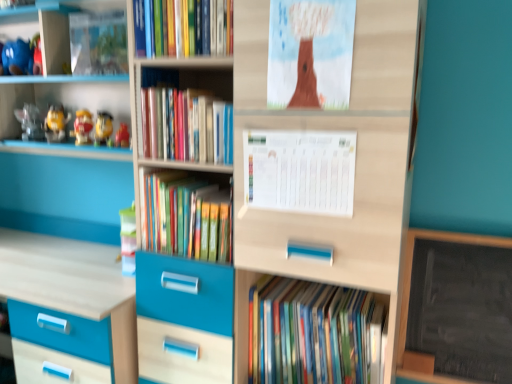
Question: From the image's perspective, is matte yellow toy at left, positioned as the fourth toy in left-to-right order, located above brown paper at upper center, positioned as the 2th paperback book in bottom-to-top order?

Choices:
 (A) no
 (B) yes

Answer: (A)

Question: Is matte yellow toy at left, positioned as the fourth toy in left-to-right order, completely or partially outside of brown paper at upper center, positioned as the 2th paperback book in bottom-to-top order?

Choices:
 (A) yes
 (B) no

Answer: (A)

Question: Considering the relative positions of matte yellow toy at left, positioned as the fourth toy in left-to-right order, and brown paper at upper center, positioned as the 2th paperback book in bottom-to-top order, in the image provided, is matte yellow toy at left, positioned as the fourth toy in left-to-right order, behind brown paper at upper center, positioned as the 2th paperback book in bottom-to-top order,?

Choices:
 (A) yes
 (B) no

Answer: (A)

Question: Can you confirm if matte yellow toy at left, positioned as the fourth toy in left-to-right order, is smaller than brown paper at upper center, arranged as the 1th paperback book when viewed from the top?

Choices:
 (A) yes
 (B) no

Answer: (B)

Question: Is brown paper at upper center, positioned as the 2th paperback book in bottom-to-top order, at the back of matte yellow toy at left, positioned as the fourth toy in left-to-right order?

Choices:
 (A) yes
 (B) no

Answer: (B)

Question: From the image's perspective, is hardcover books at center, which appears as the 3th book when ordered from the bottom, positioned above or below matte yellow toy at upper left, which is the second toy in right-to-left order?

Choices:
 (A) below
 (B) above

Answer: (A)

Question: From a real-world perspective, relative to matte yellow toy at upper left, which is the second toy in right-to-left order, is hardcover books at center, the second book when ordered from top to bottom, vertically above or below?

Choices:
 (A) below
 (B) above

Answer: (B)

Question: In terms of size, does hardcover books at center, the second book when ordered from top to bottom, appear bigger or smaller than matte yellow toy at upper left, which is the second toy in right-to-left order?

Choices:
 (A) big
 (B) small

Answer: (A)

Question: Is hardcover books at center, which appears as the 3th book when ordered from the bottom, wider or thinner than matte yellow toy at upper left, which is the second toy in right-to-left order?

Choices:
 (A) thin
 (B) wide

Answer: (B)

Question: Considering the positions of matte yellow toy at left, positioned as the fourth toy in left-to-right order, and hardcover books at center, which appears as the 3th book when ordered from the bottom, in the image, is matte yellow toy at left, positioned as the fourth toy in left-to-right order, bigger or smaller than hardcover books at center, which appears as the 3th book when ordered from the bottom,?

Choices:
 (A) big
 (B) small

Answer: (B)

Question: Is matte yellow toy at left, positioned as the fourth toy in left-to-right order, spatially inside hardcover books at center, which appears as the 3th book when ordered from the bottom, or outside of it?

Choices:
 (A) inside
 (B) outside

Answer: (B)

Question: From the image's perspective, is matte yellow toy at left, positioned as the fourth toy in left-to-right order, above or below hardcover books at center, the second book when ordered from top to bottom?

Choices:
 (A) above
 (B) below

Answer: (A)

Question: Does point pyautogui.click(x=106, y=119) appear closer or farther from the camera than point pyautogui.click(x=225, y=157)?

Choices:
 (A) farther
 (B) closer

Answer: (A)

Question: From a real-world perspective, is hardcover books at center, marked as the 2th book in a bottom-to-top arrangement, positioned above or below matte yellow toy at left, positioned as the fourth toy in left-to-right order?

Choices:
 (A) above
 (B) below

Answer: (B)

Question: Considering the positions of hardcover books at center, marked as the 2th book in a bottom-to-top arrangement, and matte yellow toy at left, positioned as the fourth toy in left-to-right order, in the image, is hardcover books at center, marked as the 2th book in a bottom-to-top arrangement, wider or thinner than matte yellow toy at left, positioned as the fourth toy in left-to-right order,?

Choices:
 (A) wide
 (B) thin

Answer: (A)